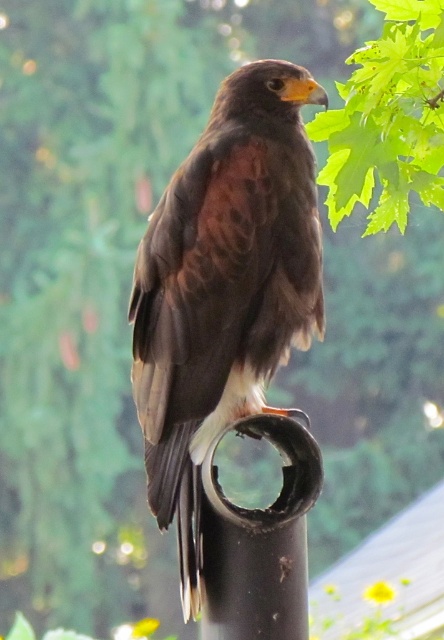
Does point (209, 360) lie in front of point (265, 563)?

That is True.

Is point (281, 186) farther from camera compared to point (274, 625)?

That is True.

You are a GUI agent. You are given a task and a screenshot of the screen. Output one action in this format:
    pyautogui.click(x=<x>, y=<y>)
    Task: Click on the brown feathered eagle at center
    This screenshot has width=444, height=640.
    Given the screenshot: What is the action you would take?
    pyautogui.click(x=224, y=288)

Locate an element on the screen. The height and width of the screenshot is (640, 444). brown feathered eagle at center is located at coordinates pos(224,288).